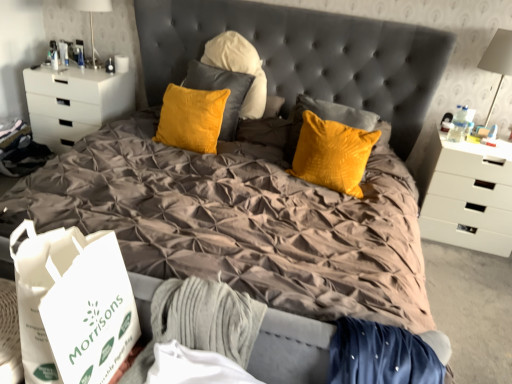
Question: Considering the positions of white matte chest of drawers at left, placed as the 2th chest of drawers when sorted from right to left, and white glossy table lamp at upper left, arranged as the first table lamp when viewed from the left, in the image, is white matte chest of drawers at left, placed as the 2th chest of drawers when sorted from right to left, taller or shorter than white glossy table lamp at upper left, arranged as the first table lamp when viewed from the left,?

Choices:
 (A) tall
 (B) short

Answer: (A)

Question: Considering the positions of point (59, 109) and point (102, 3), is point (59, 109) closer or farther from the camera than point (102, 3)?

Choices:
 (A) farther
 (B) closer

Answer: (A)

Question: Estimate the real-world distances between objects in this image. Which object is farther from the white glossy table lamp at upper left, arranged as the first table lamp when viewed from the left?

Choices:
 (A) white paper bag at lower left
 (B) white plastic table lamp at upper right, the second table lamp in the top-to-bottom sequence
 (C) white matte chest of drawers at right, the 2th chest of drawers when ordered from left to right
 (D) white matte chest of drawers at left, placed as the 2th chest of drawers when sorted from right to left

Answer: (C)

Question: Estimate the real-world distances between objects in this image. Which object is closer to the white plastic table lamp at upper right, the 2th table lamp viewed from the back?

Choices:
 (A) white matte chest of drawers at right, the 2th chest of drawers when ordered from left to right
 (B) white paper bag at lower left
 (C) white glossy table lamp at upper left, which is the 2th table lamp from bottom to top
 (D) white matte chest of drawers at left, placed as the 2th chest of drawers when sorted from right to left

Answer: (A)